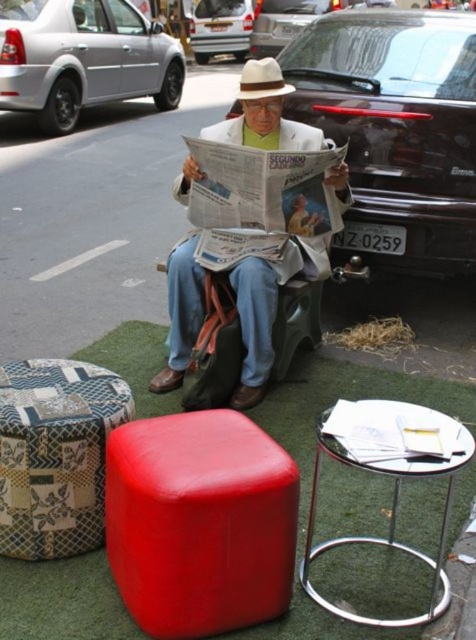
Can you confirm if metallic silver stool at lower center is wider than white felt cowboy hat at center?

Yes, metallic silver stool at lower center is wider than white felt cowboy hat at center.

Does metallic silver stool at lower center have a lesser width compared to white felt cowboy hat at center?

In fact, metallic silver stool at lower center might be wider than white felt cowboy hat at center.

I want to click on metallic silver stool at lower center, so click(x=393, y=493).

How much distance is there between patchwork fabric ottoman at lower left and metallic silver car at upper center?

A distance of 9.35 meters exists between patchwork fabric ottoman at lower left and metallic silver car at upper center.

Can you confirm if patchwork fabric ottoman at lower left is positioned below metallic silver car at upper center?

Yes.

Where is `patchwork fabric ottoman at lower left`? This screenshot has height=640, width=476. patchwork fabric ottoman at lower left is located at coordinates (56, 454).

Is silver metallic car at upper left positioned in front of white felt cowboy hat at center?

No, it is not.

Image resolution: width=476 pixels, height=640 pixels. What do you see at coordinates (82, 58) in the screenshot?
I see `silver metallic car at upper left` at bounding box center [82, 58].

Locate an element on the screen. The height and width of the screenshot is (640, 476). silver metallic car at upper left is located at coordinates (82, 58).